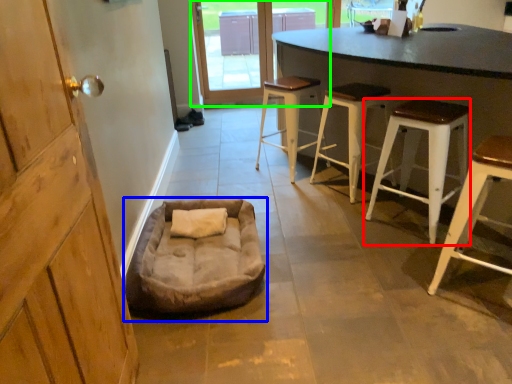
Question: Which is nearer to the stool (highlighted by a red box)? dog bed (highlighted by a blue box) or glass door (highlighted by a green box).

Choices:
 (A) dog bed
 (B) glass door

Answer: (A)